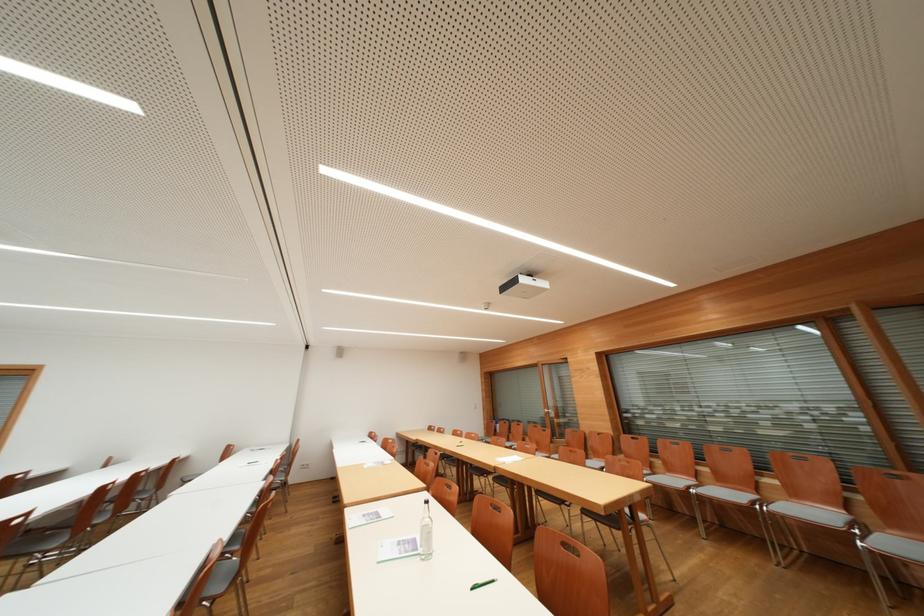
I want to click on green pen, so click(481, 584).